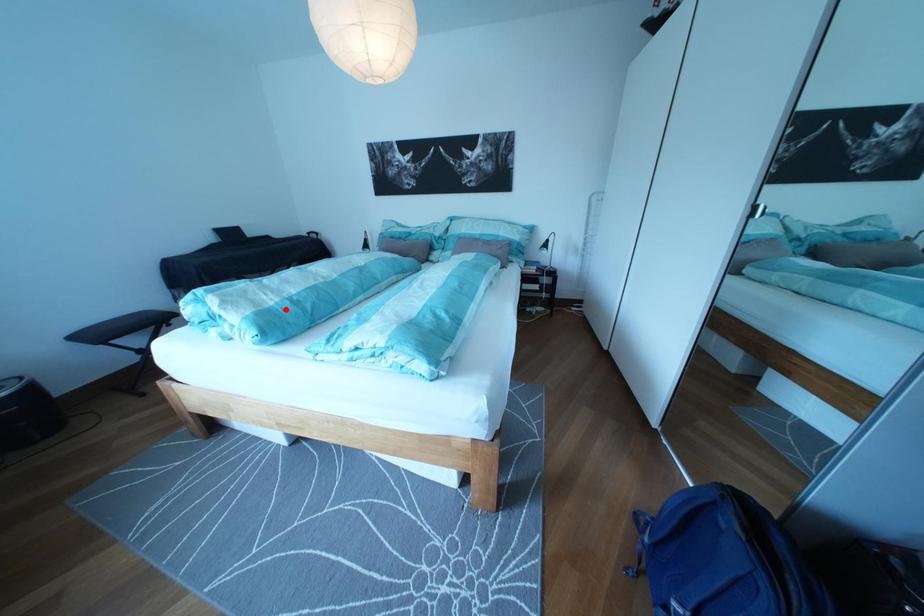
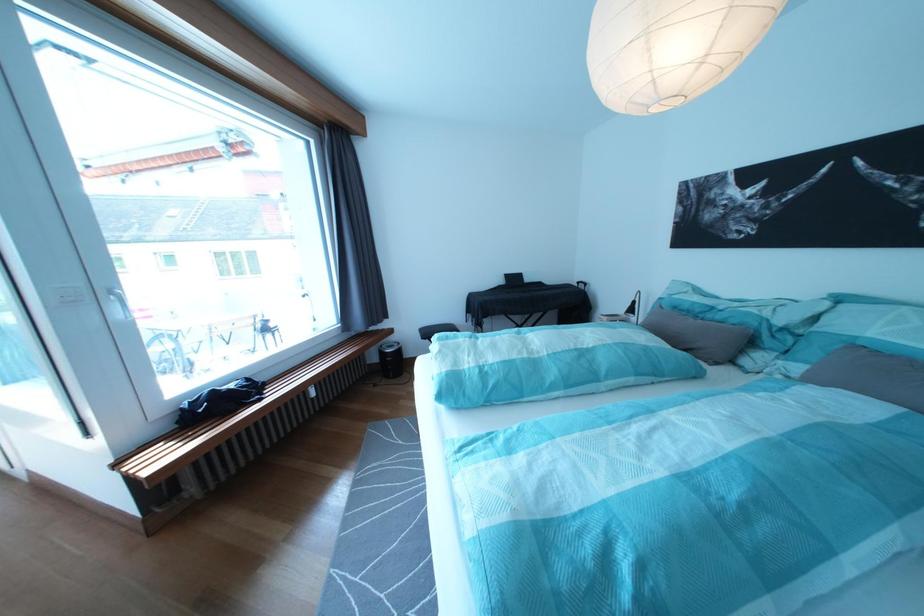
In the second image, find the point that corresponds to the highlighted location in the first image.

(480, 373)